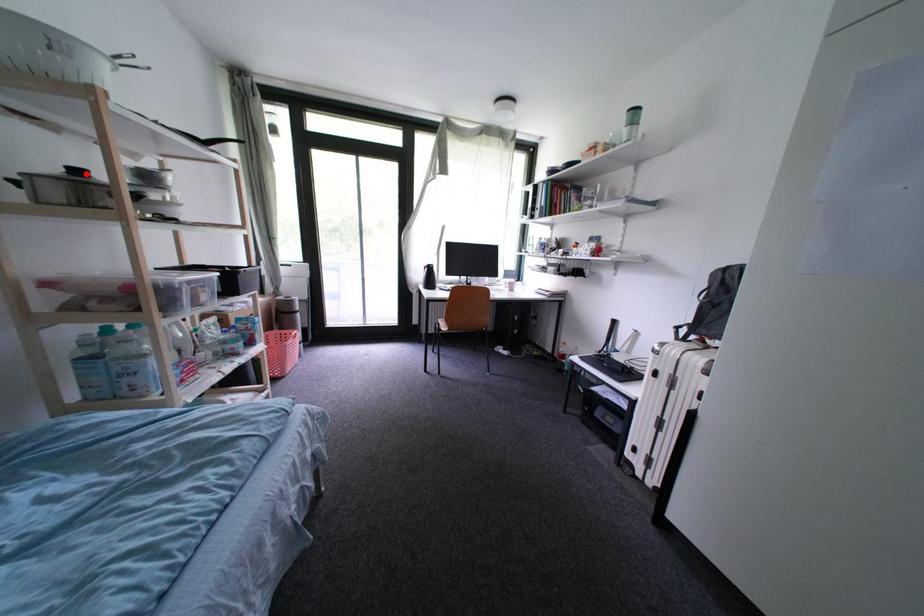
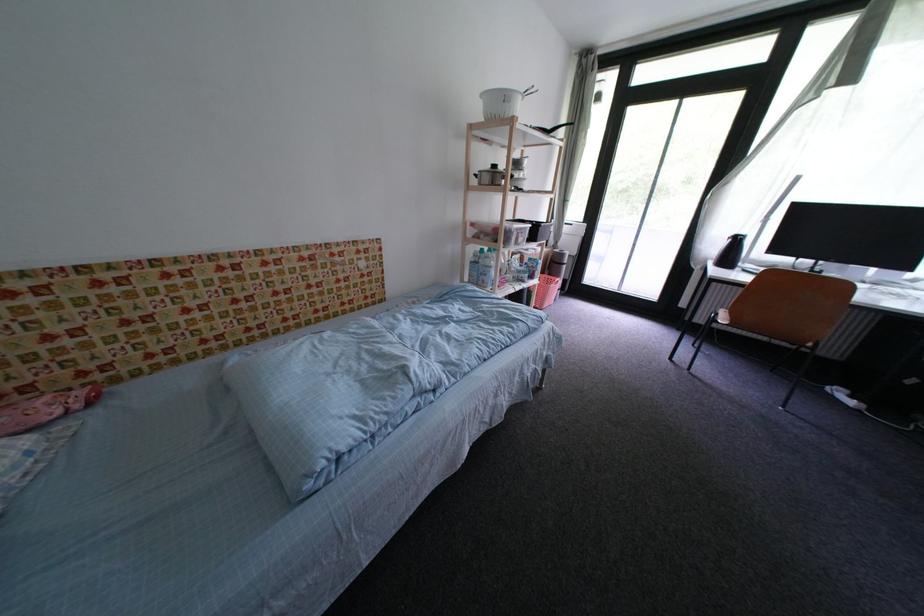
In the second image, find the point that corresponds to the highlighted location in the first image.

(503, 169)